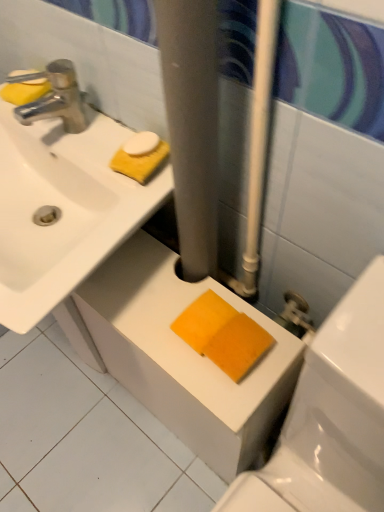
This screenshot has width=384, height=512. Identify the location of yellow sponge at upper left, which ranks as the 1th soap in bottom-to-top order. (25, 88).

Where is `chrome metallic faucet at upper left`? The image size is (384, 512). chrome metallic faucet at upper left is located at coordinates (55, 98).

The height and width of the screenshot is (512, 384). Identify the location of yellow sponge at upper left, which ranks as the 1th soap in bottom-to-top order. (25, 88).

Which is in front, orange sponge at lower center or white glossy sink at upper left?

white glossy sink at upper left is in front.

What's the angular difference between orange sponge at lower center and white glossy sink at upper left's facing directions?

The angular difference between orange sponge at lower center and white glossy sink at upper left is 1.22 degrees.

Identify the location of sink in front of the orange sponge at lower center. This screenshot has width=384, height=512. (62, 197).

Who is shorter, orange sponge at lower center or white glossy sink at upper left?

white glossy sink at upper left.

Is white glossy sink at upper left positioned with its back to white glossy ceramic tile at lower center?

No, white glossy sink at upper left is not facing away from white glossy ceramic tile at lower center.

From a real-world perspective, does white glossy sink at upper left stand above white glossy ceramic tile at lower center?

Yes, from a real-world perspective, white glossy sink at upper left is on top of white glossy ceramic tile at lower center.

Are white glossy sink at upper left and white glossy ceramic tile at lower center located far from each other?

white glossy sink at upper left is near white glossy ceramic tile at lower center, not far away.

Does white glossy sink at upper left have a greater height compared to white glossy ceramic tile at lower center?

Indeed, white glossy sink at upper left has a greater height compared to white glossy ceramic tile at lower center.

From the image's perspective, which object appears higher, white glossy sink at upper left or orange sponge at lower center?

From the image's view, white glossy sink at upper left is above.

Considering the positions of objects white glossy sink at upper left and orange sponge at lower center in the image provided, who is behind, white glossy sink at upper left or orange sponge at lower center?

white glossy sink at upper left is behind.

Who is shorter, white glossy sink at upper left or orange sponge at lower center?

white glossy sink at upper left.

How much distance is there between yellow sponge at upper left, the 2th soap in the top-to-bottom sequence, and white glossy ceramic tile at lower center?

They are 37.29 inches apart.

Which is behind, point (38, 85) or point (87, 461)?

The point (87, 461) is farther from the camera.

Looking at this image, from the image's perspective, which is above, yellow sponge at upper left, which ranks as the 1th soap in bottom-to-top order, or white glossy ceramic tile at lower center?

yellow sponge at upper left, which ranks as the 1th soap in bottom-to-top order, from the image's perspective.

What's the angular difference between yellow sponge at upper left, the 2th soap in the top-to-bottom sequence, and white glossy ceramic tile at lower center's facing directions?

yellow sponge at upper left, the 2th soap in the top-to-bottom sequence, and white glossy ceramic tile at lower center are facing 7.81 degrees away from each other.

Is white glossy sink at upper left positioned far away from yellow sponge at upper left, marked as the 1th soap in a top-to-bottom arrangement?

white glossy sink at upper left is actually quite close to yellow sponge at upper left, marked as the 1th soap in a top-to-bottom arrangement.

From a real-world perspective, which is physically above, white glossy sink at upper left or yellow sponge at upper left, marked as the 1th soap in a top-to-bottom arrangement?

From a 3D spatial view, yellow sponge at upper left, marked as the 1th soap in a top-to-bottom arrangement, is above.

Which of these two, white glossy sink at upper left or yellow sponge at upper left, marked as the 1th soap in a top-to-bottom arrangement, is thinner?

With smaller width is yellow sponge at upper left, marked as the 1th soap in a top-to-bottom arrangement.

Considering the positions of point (70, 118) and point (35, 75), is point (70, 118) closer or farther from the camera than point (35, 75)?

Point (70, 118) is positioned farther from the camera compared to point (35, 75).

Is point (37, 80) positioned in front of point (23, 114)?

No, (37, 80) is further to viewer.

This screenshot has height=512, width=384. Identify the location of the 1st soap located beneath the chrome metallic faucet at upper left (from a real-world perspective). (27, 77).

Is the depth of yellow sponge at upper left, marked as the 1th soap in a top-to-bottom arrangement, less than that of chrome metallic faucet at upper left?

No, it is not.

Consider the image. Considering the relative sizes of yellow sponge at upper left, arranged as the 2th soap when ordered from the bottom, and chrome metallic faucet at upper left in the image provided, is yellow sponge at upper left, arranged as the 2th soap when ordered from the bottom, shorter than chrome metallic faucet at upper left?

Indeed, yellow sponge at upper left, arranged as the 2th soap when ordered from the bottom, has a lesser height compared to chrome metallic faucet at upper left.

From the image's perspective, between yellow sponge at upper left, which ranks as the 1th soap in bottom-to-top order, and chrome metallic faucet at upper left, who is located below?

chrome metallic faucet at upper left is shown below in the image.

Based on the photo, would you say yellow sponge at upper left, which ranks as the 1th soap in bottom-to-top order, is to the left or to the right of chrome metallic faucet at upper left in the picture?

Clearly, yellow sponge at upper left, which ranks as the 1th soap in bottom-to-top order, is on the left of chrome metallic faucet at upper left in the image.

How far apart are yellow sponge at upper left, the 2th soap in the top-to-bottom sequence, and chrome metallic faucet at upper left?

yellow sponge at upper left, the 2th soap in the top-to-bottom sequence, and chrome metallic faucet at upper left are 5.18 centimeters apart from each other.

Are yellow sponge at upper left, the 2th soap in the top-to-bottom sequence, and chrome metallic faucet at upper left far apart?

yellow sponge at upper left, the 2th soap in the top-to-bottom sequence, is near chrome metallic faucet at upper left, not far away.

This screenshot has width=384, height=512. I want to click on counter top below the white glossy sink at upper left (from the image's perspective), so click(184, 356).

The image size is (384, 512). What are the coordinates of `ceramic tile to the left of white glossy sink at upper left` in the screenshot? It's located at (86, 438).

When comparing their distances from white glossy sink at upper left, does chrome metallic faucet at upper left or yellow sponge at upper left, arranged as the 2th soap when ordered from the bottom, seem further?

yellow sponge at upper left, arranged as the 2th soap when ordered from the bottom.

From the image, which object appears to be nearer to orange sponge at lower center, white glossy ceramic tile at lower center or yellow sponge at upper left, arranged as the 2th soap when ordered from the bottom?

white glossy ceramic tile at lower center is closer to orange sponge at lower center.

When comparing their distances from yellow sponge at upper left, which ranks as the 1th soap in bottom-to-top order, does yellow sponge at upper left, marked as the 1th soap in a top-to-bottom arrangement, or orange sponge at lower center seem closer?

yellow sponge at upper left, marked as the 1th soap in a top-to-bottom arrangement.

Looking at the image, which one is located closer to orange sponge at lower center, yellow sponge at upper left, which ranks as the 1th soap in bottom-to-top order, or white glossy ceramic tile at lower center?

The object closer to orange sponge at lower center is white glossy ceramic tile at lower center.

Considering their positions, is chrome metallic faucet at upper left positioned further to orange sponge at lower center than yellow sponge at upper left, which ranks as the 1th soap in bottom-to-top order?

yellow sponge at upper left, which ranks as the 1th soap in bottom-to-top order, is further to orange sponge at lower center.

Based on their spatial positions, is orange sponge at lower center or white glossy sink at upper left closer to yellow sponge at upper left, which ranks as the 1th soap in bottom-to-top order?

white glossy sink at upper left is positioned closer to the anchor yellow sponge at upper left, which ranks as the 1th soap in bottom-to-top order.

Looking at the image, which one is located closer to chrome metallic faucet at upper left, yellow sponge at upper left, the 2th soap in the top-to-bottom sequence, or white glossy sink at upper left?

yellow sponge at upper left, the 2th soap in the top-to-bottom sequence, is positioned closer to the anchor chrome metallic faucet at upper left.

When comparing their distances from white glossy ceramic tile at lower center, does white glossy sink at upper left or yellow sponge at upper left, arranged as the 2th soap when ordered from the bottom, seem closer?

Among the two, white glossy sink at upper left is located nearer to white glossy ceramic tile at lower center.

This screenshot has width=384, height=512. In order to click on tap between white glossy sink at upper left and yellow sponge at upper left, which ranks as the 1th soap in bottom-to-top order, along the z-axis in this screenshot , I will do `click(55, 98)`.

Where is `sink between yellow sponge at upper left, which ranks as the 1th soap in bottom-to-top order, and orange sponge at lower center, in the vertical direction`? Image resolution: width=384 pixels, height=512 pixels. sink between yellow sponge at upper left, which ranks as the 1th soap in bottom-to-top order, and orange sponge at lower center, in the vertical direction is located at coordinates (x=62, y=197).

Where is `sink between chrome metallic faucet at upper left and white glossy ceramic tile at lower center vertically`? This screenshot has width=384, height=512. sink between chrome metallic faucet at upper left and white glossy ceramic tile at lower center vertically is located at coordinates point(62,197).

I want to click on toilet that lies between yellow sponge at upper left, the 2th soap in the top-to-bottom sequence, and white glossy ceramic tile at lower center from top to bottom, so click(x=330, y=417).